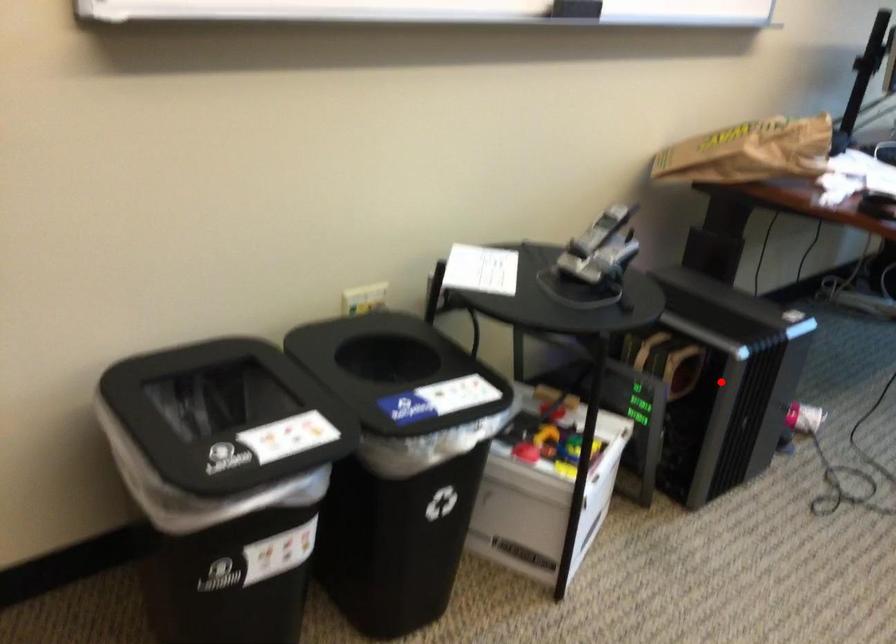
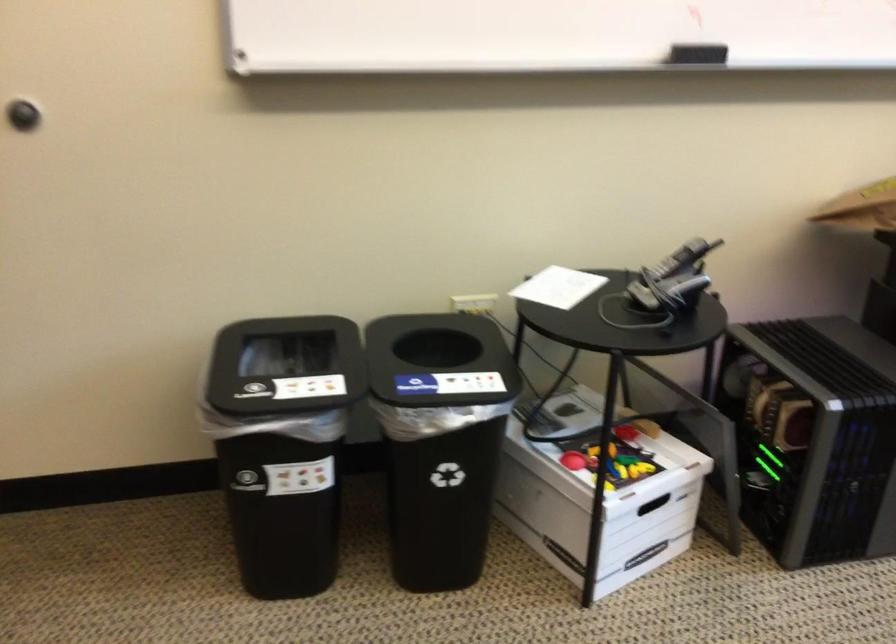
Where in the second image is the point corresponding to the highlighted location from the first image?

(813, 436)